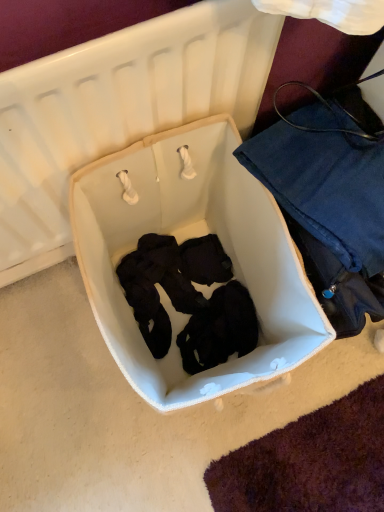
Question: Based on their sizes in the image, would you say denim fabric at right is bigger or smaller than white fabric infant bed at center?

Choices:
 (A) big
 (B) small

Answer: (B)

Question: Is denim fabric at right taller or shorter than white fabric infant bed at center?

Choices:
 (A) short
 (B) tall

Answer: (B)

Question: Does point (241, 150) appear closer or farther from the camera than point (157, 224)?

Choices:
 (A) farther
 (B) closer

Answer: (B)

Question: Looking at the image, does white fabric infant bed at center seem bigger or smaller compared to denim fabric at right?

Choices:
 (A) big
 (B) small

Answer: (A)

Question: Would you say white fabric infant bed at center is to the left or to the right of denim fabric at right in the picture?

Choices:
 (A) right
 (B) left

Answer: (B)

Question: Is point (238, 137) closer or farther from the camera than point (370, 307)?

Choices:
 (A) closer
 (B) farther

Answer: (B)

Question: Would you say white fabric infant bed at center is inside or outside denim fabric at right?

Choices:
 (A) outside
 (B) inside

Answer: (A)